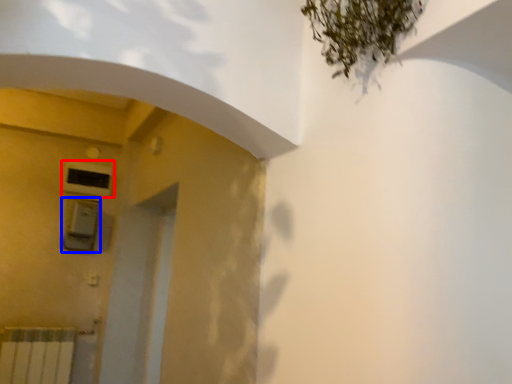
Question: Which object appears farthest to the camera in this image, air conditioning (highlighted by a red box) or lift (highlighted by a blue box)?

Choices:
 (A) air conditioning
 (B) lift

Answer: (A)